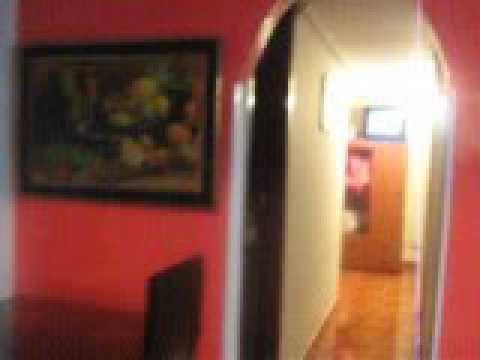
Identify the location of black painting frame. Image resolution: width=480 pixels, height=360 pixels. (212, 79), (197, 201), (31, 193), (53, 50).